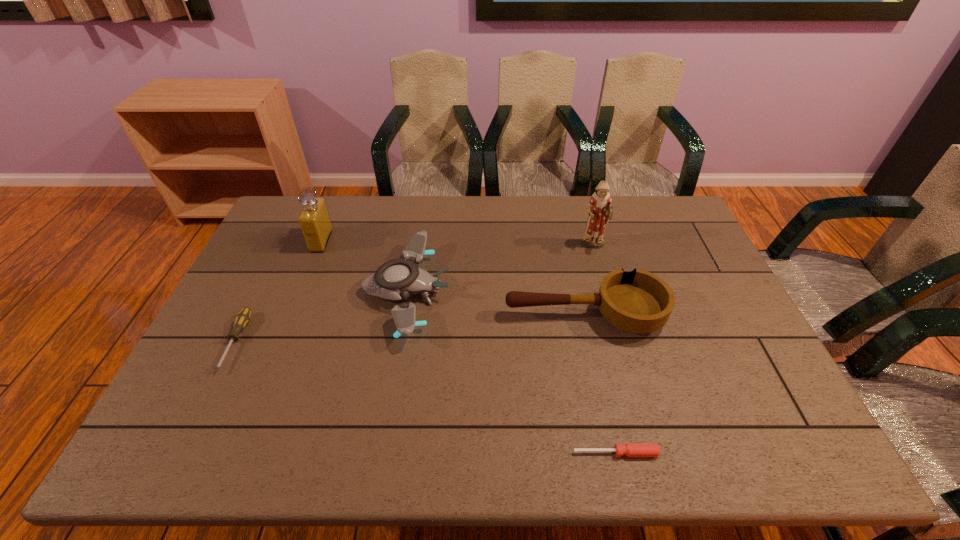
Where is `vacant position located 0.120m on the front-facing side of the fifth shortest object`? The image size is (960, 540). vacant position located 0.120m on the front-facing side of the fifth shortest object is located at coordinates (365, 241).

Where is `free region located 0.230m with the handle on the side of the saucepan`? This screenshot has width=960, height=540. free region located 0.230m with the handle on the side of the saucepan is located at coordinates (424, 315).

Where is `vacant space located with the handle on the side of the saucepan`? The width and height of the screenshot is (960, 540). vacant space located with the handle on the side of the saucepan is located at coordinates (421, 315).

This screenshot has height=540, width=960. What are the coordinates of `vacant space situated with the handle on the side of the saucepan` in the screenshot? It's located at pos(449,315).

At what (x,y) coordinates should I click in order to perform the action: click on vacant space located on the front-facing side of the drone. Please return your answer as a coordinate pair (x, y). This screenshot has width=960, height=540. Looking at the image, I should click on (580, 292).

Image resolution: width=960 pixels, height=540 pixels. I want to click on vacant region located at the tip of the farther screwdriver, so click(x=191, y=431).

Locate an element on the screen. The width and height of the screenshot is (960, 540). blank space located on the left of the nearest object is located at coordinates (474, 453).

This screenshot has height=540, width=960. Find the location of `object at the far edge`. object at the far edge is located at coordinates (314, 219).

You are a GUI agent. You are given a task and a screenshot of the screen. Output one action in this format:
    pyautogui.click(x=<x>, y=<y>)
    Task: Click on the object located in the near edge section of the desktop
    
    Given the screenshot: What is the action you would take?
    pyautogui.click(x=629, y=449)

Locate an element on the screen. This screenshot has width=960, height=540. object present at the left edge is located at coordinates (242, 318).